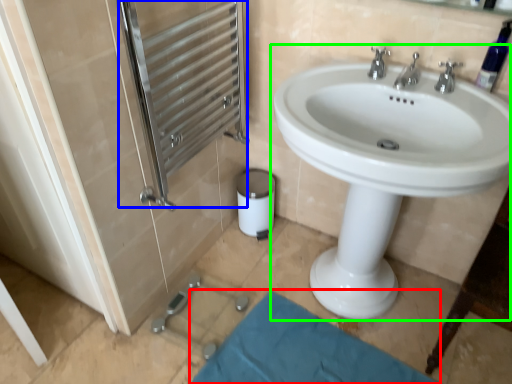
Question: Based on their relative distances, which object is nearer to bath mat (highlighted by a red box)? Choose from screen door (highlighted by a blue box) and sink (highlighted by a green box).

Choices:
 (A) screen door
 (B) sink

Answer: (B)